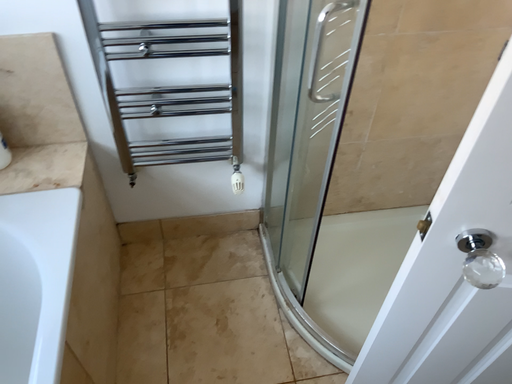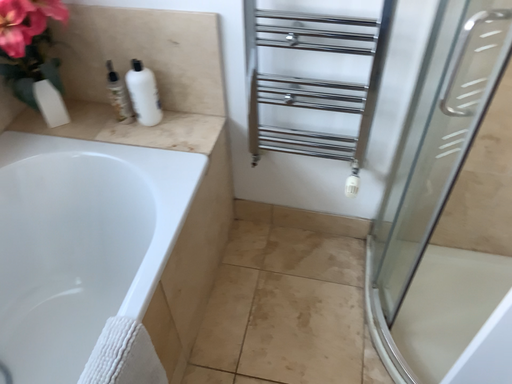
Question: Which way did the camera rotate in the video?

Choices:
 (A) rotated right
 (B) rotated left

Answer: (B)